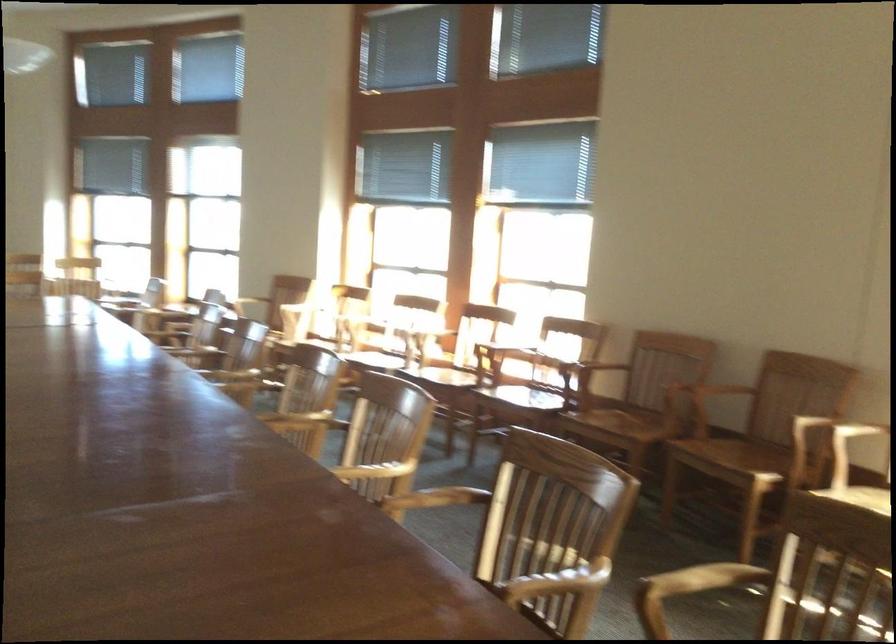
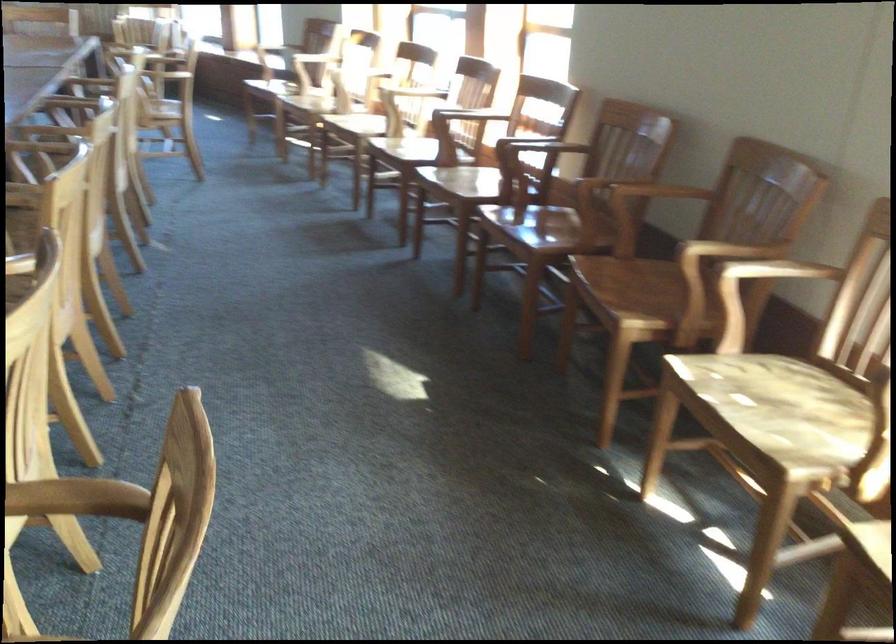
The images are taken continuously from a first-person perspective. In which direction are you moving?

The cameraman walked toward right, forward.